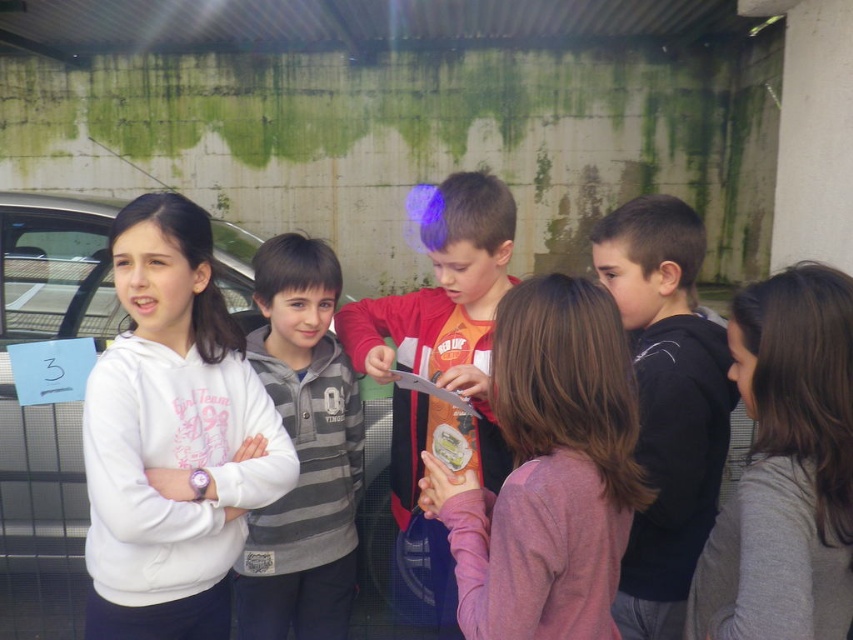
You are a photographer trying to capture a candid shot of the children. You notice the white fleece sweatshirt at left and the gray striped hoodie at center. Which child should you focus on to ensure the other remains in the background?

You should focus on the white fleece sweatshirt at left because it is in front of the gray striped hoodie at center, so the gray striped hoodie at center will be in the background.

You are a photographer standing at the origin point of the image coordinate system. You want to take a photo of the black matte hoodie at center. What are the coordinates where you should aim your camera?

The coordinates to aim your camera are at point (666, 403), as that is where the black matte hoodie at center is located.